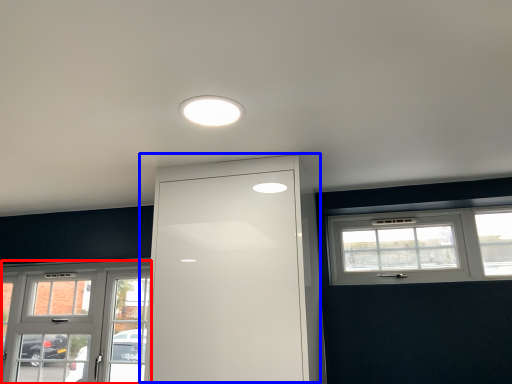
Question: Among these objects, which one is nearest to the camera, window (highlighted by a red box) or door (highlighted by a blue box)?

Choices:
 (A) window
 (B) door

Answer: (B)